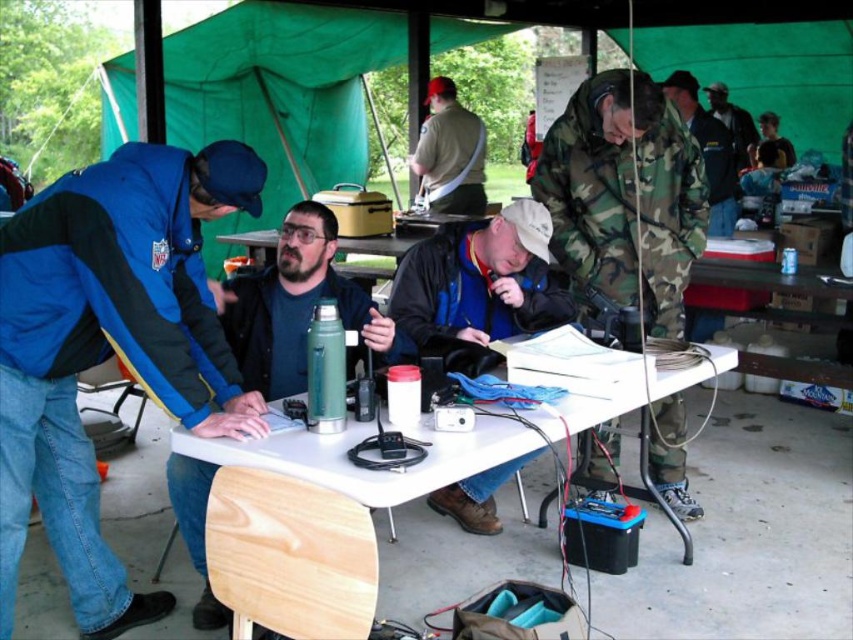
Question: Among these points, which one is farthest from the camera?

Choices:
 (A) (494, 228)
 (B) (714, 195)
 (C) (732, 128)

Answer: (C)

Question: Among these points, which one is farthest from the camera?

Choices:
 (A) (755, 148)
 (B) (577, 376)
 (C) (4, 371)
 (D) (280, 285)

Answer: (A)

Question: Does matte green thermos at center appear under green matte thermos at center?

Choices:
 (A) yes
 (B) no

Answer: (B)

Question: Based on their relative distances, which object is farther from the camouflage uniform at right?

Choices:
 (A) matte green thermos at center
 (B) matte black jacket at center
 (C) camouflage jacket at center
 (D) green matte thermos at center

Answer: (A)

Question: Is matte black jacket at center above camouflage uniform at right?

Choices:
 (A) yes
 (B) no

Answer: (B)

Question: Does blue fleece jacket at left appear on the right side of camouflage uniform at right?

Choices:
 (A) no
 (B) yes

Answer: (A)